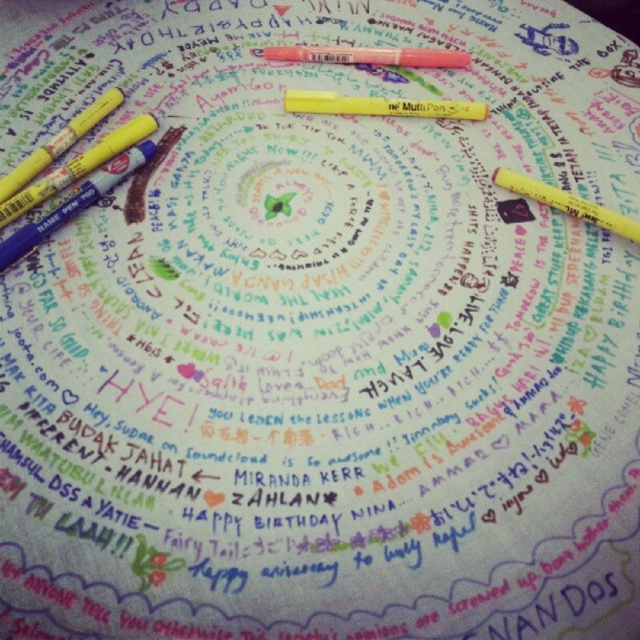
From the picture: You are an artist holding a yellow matte pen at center and a matte pink crayon at center. You want to place a sticker exactly between them. Where should you place it?

Place the sticker between the yellow matte pen at center and the matte pink crayon at center, closer to the yellow matte pen at center since it is nearer to you than the matte pink crayon at center.